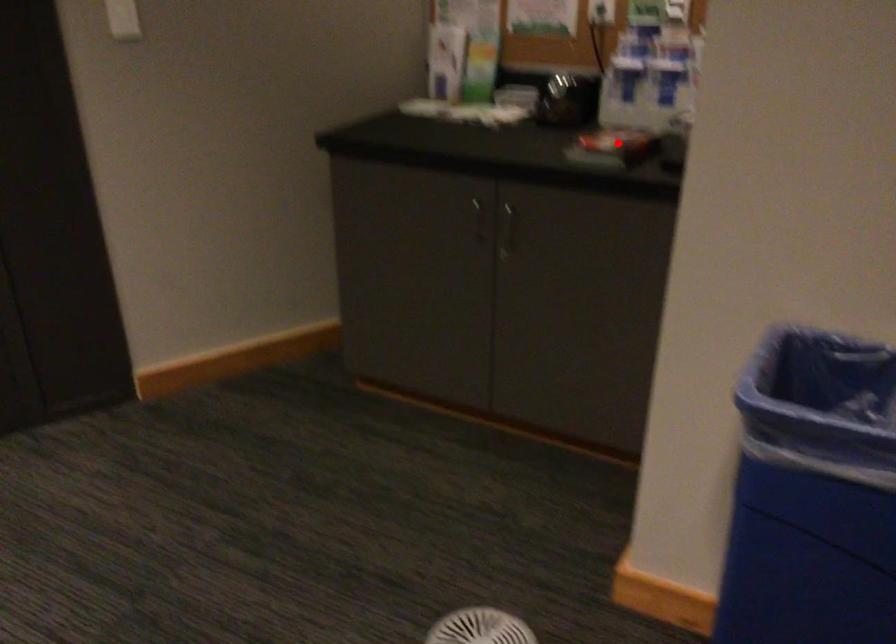
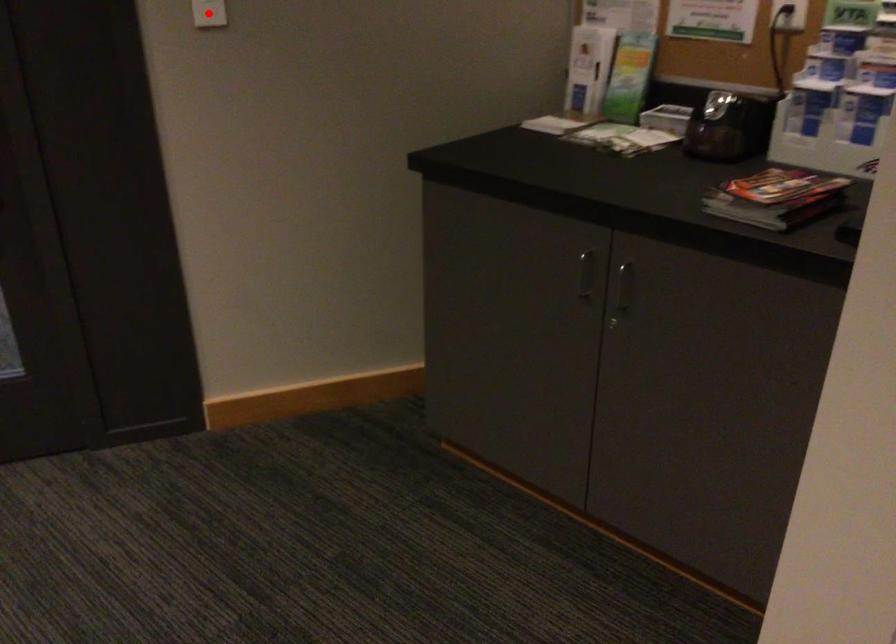
I am providing you with two images of the same scene from different viewpoints. A red point is marked on the first image and another point is marked on the second image. Is the marked point in image1 the same physical position as the marked point in image2?

No